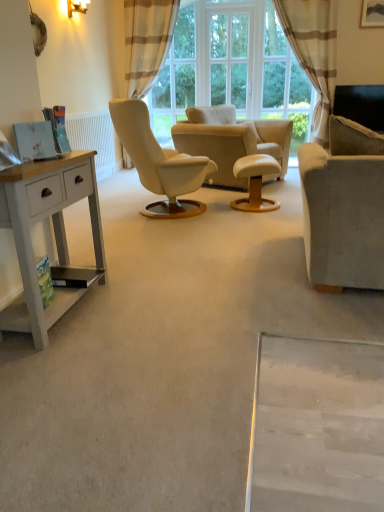
Image resolution: width=384 pixels, height=512 pixels. Find the location of `vacant area that lies in front of white leather ottoman at center`. vacant area that lies in front of white leather ottoman at center is located at coordinates (255, 218).